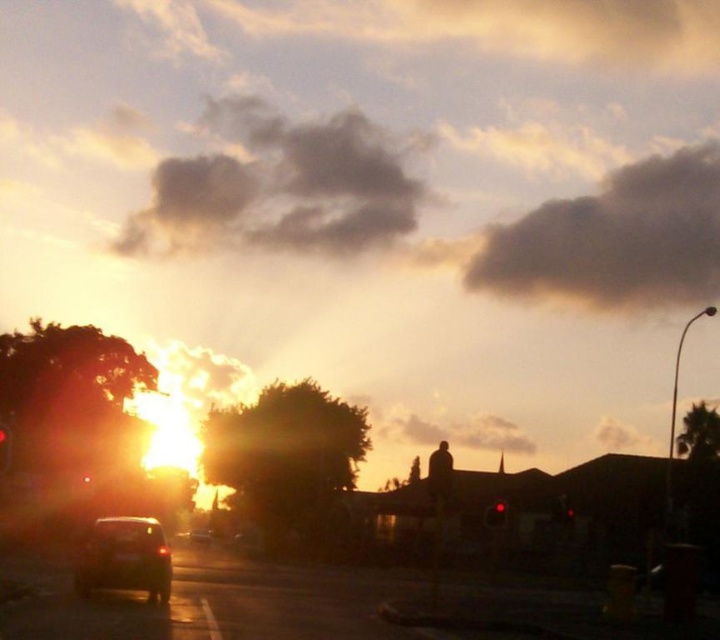
You are taking a photo of the sunset scene and want to focus on both the point at coordinates point (716, 211) and the point at coordinates point (413, 419). Which point is closer to your camera lens?

Point (716, 211) is further to the camera than point (413, 419), so the point at coordinates point (413, 419) is closer to your camera lens.

You are a photographer standing at the edge of the residential street in the sunset scene. You want to capture a photo of the dark gray cloud at upper right. Based on the scene description, can you estimate whether the cloud is within the typical focus range of a standard camera lens?

The dark gray cloud at upper right is 200.10 meters away from the camera. Since standard camera lenses generally have a focus range that can handle distances well beyond 200 meters, the cloud is within the typical focus range and can be captured clearly.

You are standing at the center of the image and want to find the shiny black car at lower left. According to the coordinates provided, in which direction should you look to locate it?

The shiny black car at lower left is located at coordinates point (125, 557), which means you should look towards the lower left direction to find it.